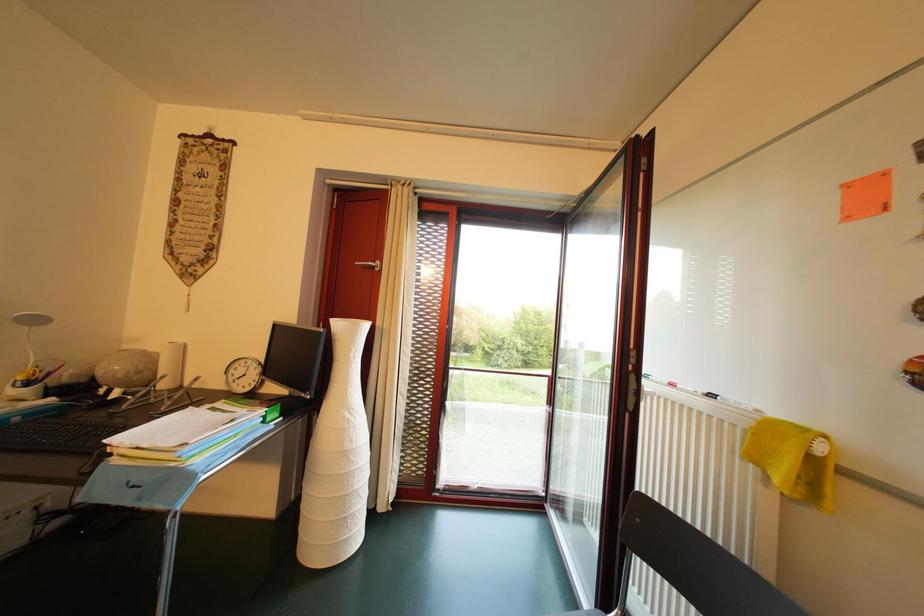
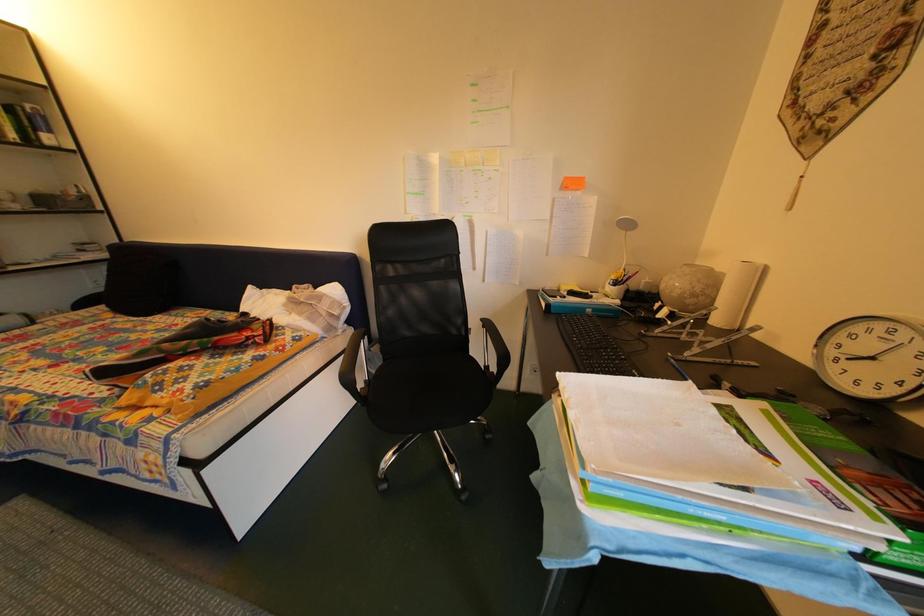
The images are taken continuously from a first-person perspective. In which direction is your viewpoint rotating?

The camera's rotation is toward left-down.